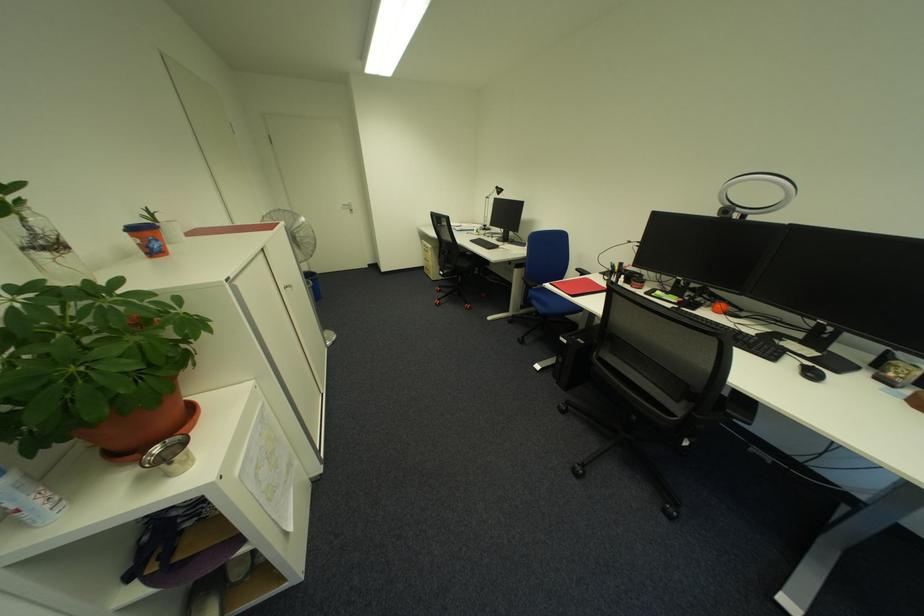
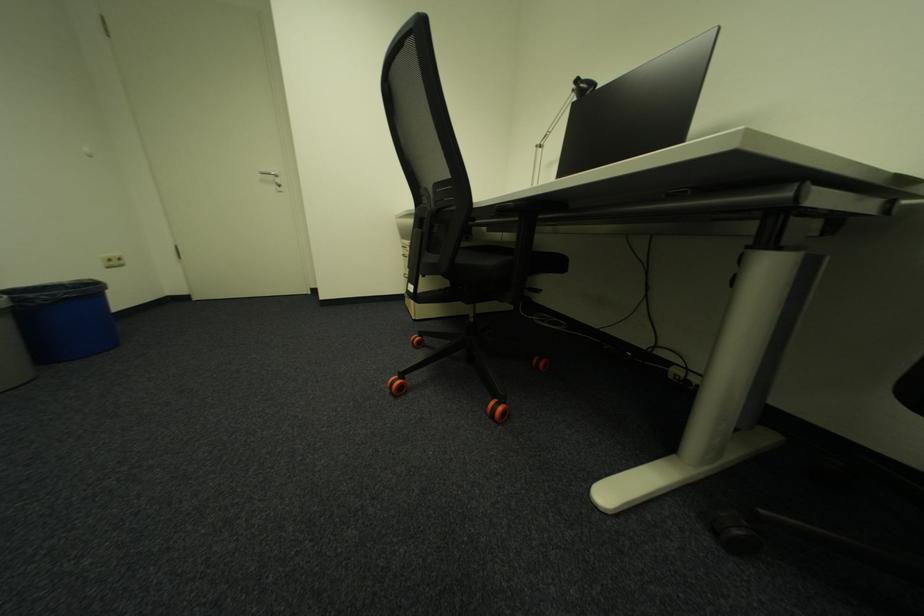
Question: Which direction would the cameraman need to move to produce the second image? Reply with the corresponding letter.

Choices:
 (A) Left
 (B) Right
 (C) Forward
 (D) Backward

Answer: (C)